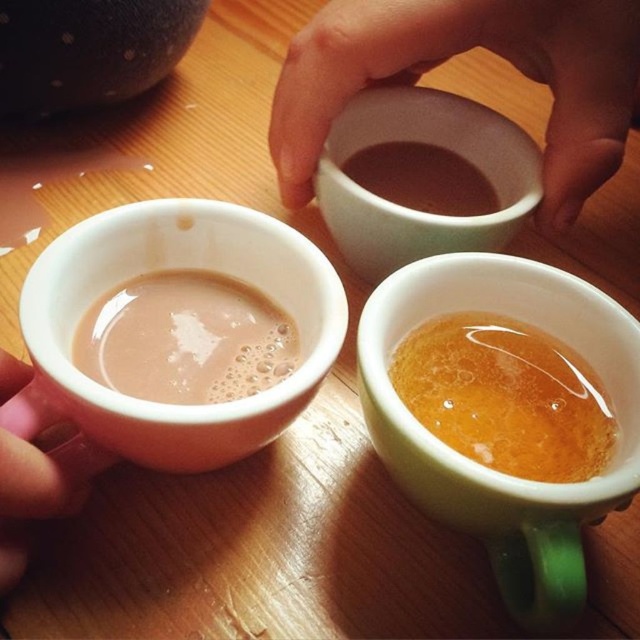
Question: Among these points, which one is nearest to the camera?

Choices:
 (A) (84, 429)
 (B) (577, 168)
 (C) (572, 356)
 (D) (490, 284)

Answer: (A)

Question: Which point is closer to the camera?

Choices:
 (A) (529, 150)
 (B) (54, 284)
 (C) (518, 493)
 (D) (428, 168)

Answer: (C)

Question: Can you confirm if matte ceramic mug at left is bigger than pink flesh at lower left?

Choices:
 (A) no
 (B) yes

Answer: (B)

Question: Can you confirm if translucent amber liquid at center is positioned above matte ceramic mug at lower left?

Choices:
 (A) yes
 (B) no

Answer: (B)

Question: Which of these objects is positioned farthest from the green matte mug at lower right?

Choices:
 (A) white glossy mug at upper center
 (B) matte ceramic mug at lower left
 (C) matte ceramic cup at upper center

Answer: (C)

Question: Considering the relative positions of matte ceramic mug at left and matte ceramic cup at upper center in the image provided, where is matte ceramic mug at left located with respect to matte ceramic cup at upper center?

Choices:
 (A) below
 (B) above

Answer: (A)